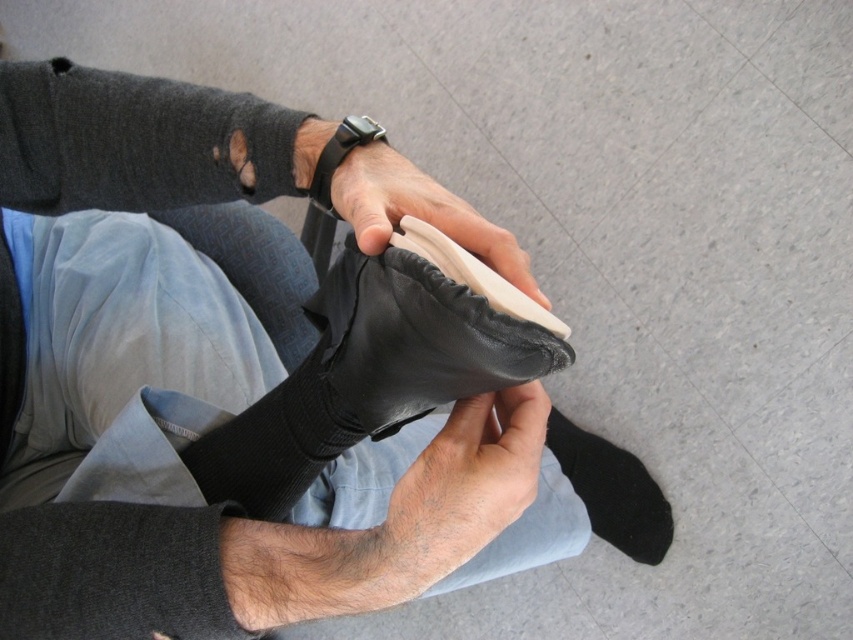
You are a photographer setting up a close shot of hands holding a shoe. You need to ensure both the smooth skin at center and the black suede sock at lower right are in focus. Which object should you adjust your focus to prioritize to ensure both are sharp?

The smooth skin at center is closer to the viewer than the black suede sock at lower right. To ensure both are in focus, prioritize focusing on the smooth skin at center first since it is closer, and the depth of field will naturally include the black suede sock at lower right if the focus is set correctly.